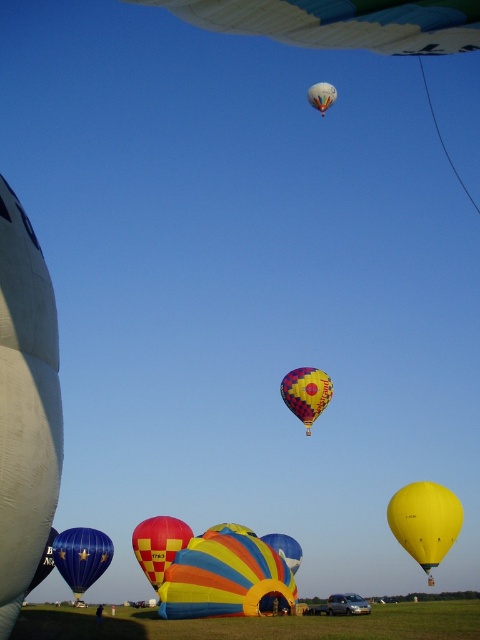
Is yellow matte balloon at lower right thinner than multicolored fabric hot air balloon at upper center?

Yes.

Can you confirm if yellow matte balloon at lower right is positioned above multicolored fabric hot air balloon at upper center?

No.

You are a GUI agent. You are given a task and a screenshot of the screen. Output one action in this format:
    pyautogui.click(x=<x>, y=<y>)
    Task: Click on the yellow matte balloon at lower right
    This screenshot has height=640, width=480.
    Given the screenshot: What is the action you would take?
    pyautogui.click(x=424, y=522)

Identify the location of yellow matte balloon at lower right. Image resolution: width=480 pixels, height=640 pixels. (424, 522).

Is point (338, 632) positioned in front of point (415, 547)?

That is True.

Does yellow fabric balloon at lower center come in front of yellow matte balloon at lower right?

Yes.

Is point (384, 620) closer to camera compared to point (414, 483)?

Yes, point (384, 620) is closer to viewer.

Locate an element on the screen. This screenshot has width=480, height=640. yellow fabric balloon at lower center is located at coordinates (259, 625).

Does rainbow striped balloon at center come behind blue glossy balloon at lower left?

That is False.

Does point (196, 589) come closer to viewer compared to point (69, 545)?

Yes, point (196, 589) is in front of point (69, 545).

Find the location of a particular element. Image resolution: width=480 pixels, height=640 pixels. rainbow striped balloon at center is located at coordinates (226, 577).